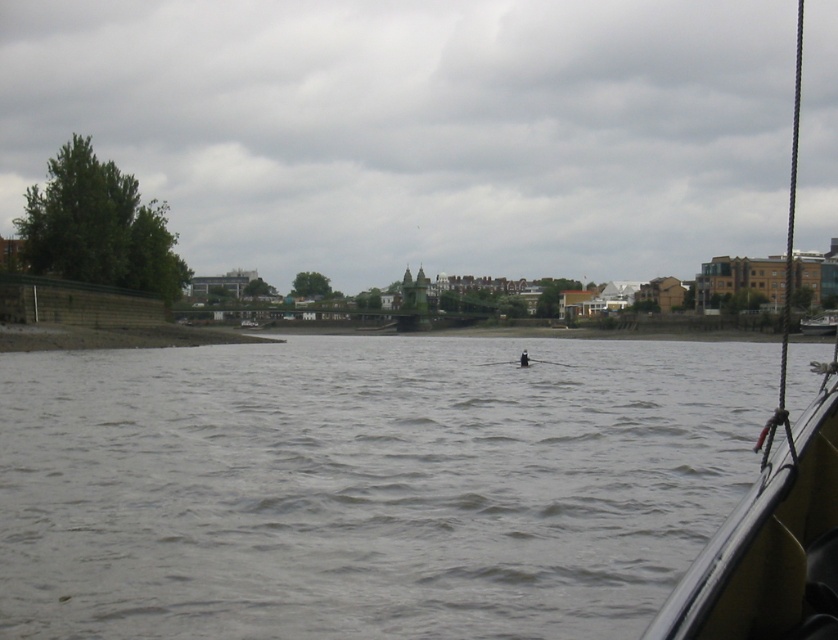
Between point (518, 362) and point (520, 358), which one is positioned in front?

Point (520, 358)

Who is positioned more to the left, black rubber paddle at center or white fabric person at center?

white fabric person at center

Between point (508, 362) and point (526, 360), which one is positioned behind?

The point (508, 362) is more distant.

Locate an element on the screen. The image size is (838, 640). black rubber paddle at center is located at coordinates (526, 362).

Can you confirm if cloudy sky at upper center is positioned above black rubber boat at right?

Actually, cloudy sky at upper center is below black rubber boat at right.

Does cloudy sky at upper center come in front of black rubber boat at right?

No, cloudy sky at upper center is behind black rubber boat at right.

Where is `cloudy sky at upper center`? This screenshot has height=640, width=838. cloudy sky at upper center is located at coordinates (419, 129).

Between gray water at center and black rubber boat at right, which one has more height?

black rubber boat at right

Identify the location of gray water at center. (366, 484).

Is point (680, 497) more distant than point (799, 493)?

Yes, it is behind point (799, 493).

Locate an element on the screen. gray water at center is located at coordinates (366, 484).